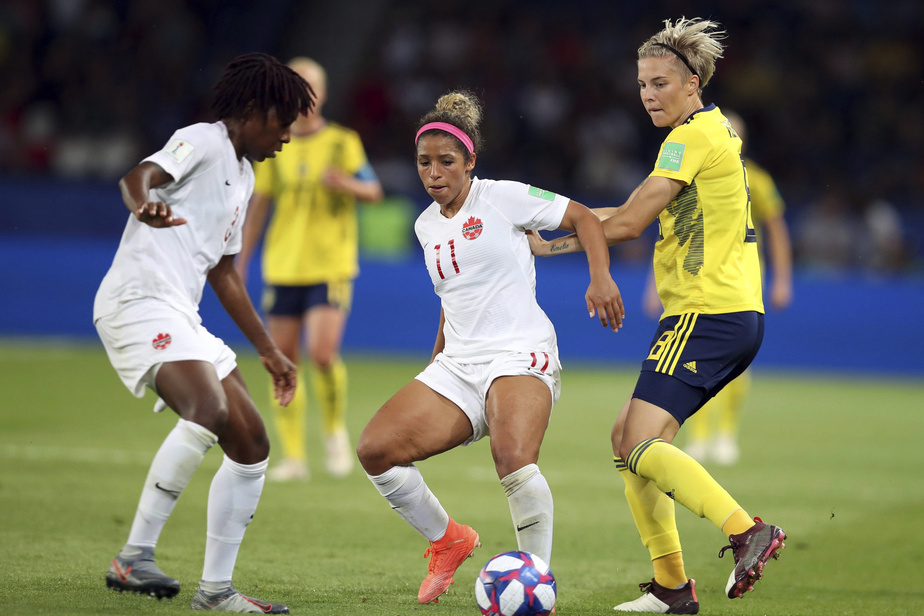
This screenshot has height=616, width=924. Find the location of `shoe`. shoe is located at coordinates (239, 612), (144, 580), (442, 565), (661, 599), (746, 562), (724, 451), (700, 453), (332, 451), (281, 469).